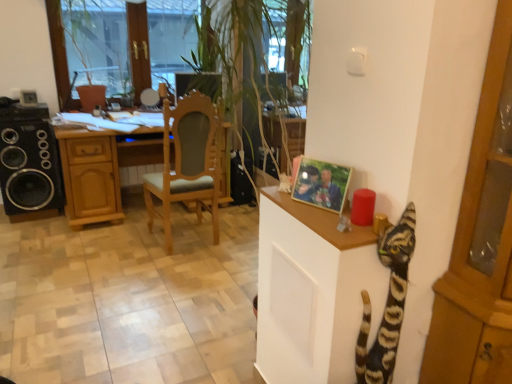
This screenshot has width=512, height=384. In order to click on light brown wood chair at center in this screenshot , I will do `click(188, 163)`.

Image resolution: width=512 pixels, height=384 pixels. What are the coordinates of `wooden photo frame at upper right` in the screenshot? It's located at tap(321, 184).

Find the location of a particular element. This screenshot has width=512, height=384. wooden desk at center is located at coordinates (101, 170).

This screenshot has height=384, width=512. I want to click on black matte speaker at left, so click(29, 161).

You are a GUI agent. You are given a task and a screenshot of the screen. Output one action in this format:
    pyautogui.click(x=<x>, y=<y>)
    Task: Click on the light brown wood chair at center
    Image resolution: width=512 pixels, height=384 pixels.
    Given the screenshot: What is the action you would take?
    [188, 163]

From the image's perspective, would you say light brown wood chair at center is positioned over black matte speaker at left?

Incorrect, from the image's perspective, light brown wood chair at center is lower than black matte speaker at left.

Would you say light brown wood chair at center is a long distance from black matte speaker at left?

Yes.

Is light brown wood chair at center in front of or behind black matte speaker at left in the image?

Clearly, light brown wood chair at center is in front of black matte speaker at left.

Considering the sizes of objects light brown wood chair at center and black matte speaker at left in the image provided, who is thinner, light brown wood chair at center or black matte speaker at left?

black matte speaker at left is thinner.

Does point (33, 112) come behind point (88, 2)?

No.

Is black matte speaker at left smaller than transparent glass window at upper center?

Correct, black matte speaker at left occupies less space than transparent glass window at upper center.

Where is `speaker in front of the transparent glass window at upper center`? speaker in front of the transparent glass window at upper center is located at coordinates (29, 161).

Considering the relative sizes of black matte speaker at left and transparent glass window at upper center in the image provided, is black matte speaker at left wider than transparent glass window at upper center?

Correct, the width of black matte speaker at left exceeds that of transparent glass window at upper center.

From a real-world perspective, is wooden photo frame at upper right positioned over wooden cabinet at right based on gravity?

Indeed, from a real-world perspective, wooden photo frame at upper right stands above wooden cabinet at right.

Is point (325, 191) closer or farther from the camera than point (463, 378)?

Point (325, 191).

What's the angular difference between wooden photo frame at upper right and wooden cabinet at right's facing directions?

The angle between the facing direction of wooden photo frame at upper right and the facing direction of wooden cabinet at right is 70.6 degrees.

Considering the positions of objects wooden photo frame at upper right and wooden cabinet at right in the image provided, who is behind, wooden photo frame at upper right or wooden cabinet at right?

wooden photo frame at upper right is further from the camera.

Would you consider transparent glass window screen at upper left to be distant from black matte speaker at left?

No, transparent glass window screen at upper left is not far away from black matte speaker at left.

Which is less distant, [112,57] or [8,137]?

The point [8,137] is in front.

From the image's perspective, is transparent glass window screen at upper left on black matte speaker at left?

Yes, from the image's perspective, transparent glass window screen at upper left is on top of black matte speaker at left.

Considering the sizes of objects wooden desk at center and wooden photo frame at upper right in the image provided, who is smaller, wooden desk at center or wooden photo frame at upper right?

wooden photo frame at upper right is smaller.

Is wooden desk at center directly adjacent to wooden photo frame at upper right?

No, wooden desk at center is not beside wooden photo frame at upper right.

How much distance is there between wooden desk at center and wooden photo frame at upper right?

wooden desk at center is 2.20 meters from wooden photo frame at upper right.

Would you say wooden desk at center is outside wooden photo frame at upper right?

Indeed, wooden desk at center is completely outside wooden photo frame at upper right.

Does light brown wood chair at center turn towards wooden cabinet at right?

No, light brown wood chair at center is not oriented towards wooden cabinet at right.

Considering the sizes of objects light brown wood chair at center and wooden cabinet at right in the image provided, who is wider, light brown wood chair at center or wooden cabinet at right?

With larger width is light brown wood chair at center.

Considering the positions of objects light brown wood chair at center and wooden cabinet at right in the image provided, who is more to the left, light brown wood chair at center or wooden cabinet at right?

light brown wood chair at center.

Is wooden cabinet at right surrounded by light brown wood chair at center?

No, wooden cabinet at right is located outside of light brown wood chair at center.

Can you tell me how much light brown wood chair at center and wooden desk at center differ in facing direction?

They differ by 180 degrees in their facing directions.

From a real-world perspective, does light brown wood chair at center sit lower than wooden desk at center?

No, from a real-world perspective, light brown wood chair at center is not beneath wooden desk at center.

Who is taller, light brown wood chair at center or wooden desk at center?

Standing taller between the two is light brown wood chair at center.

Is light brown wood chair at center with wooden desk at center?

No, light brown wood chair at center is not beside wooden desk at center.

Find the location of a particular element. chair in front of the black matte speaker at left is located at coordinates coord(188,163).

Where is `window above the black matte speaker at left (from the image's perspective)`? The image size is (512, 384). window above the black matte speaker at left (from the image's perspective) is located at coordinates [x=71, y=54].

Which object lies further to the anchor point black matte speaker at left, wooden desk at center or transparent glass window screen at upper left?

transparent glass window screen at upper left lies further to black matte speaker at left than the other object.

Based on their spatial positions, is wooden cabinet at right or striped fur cat at right further from light brown wood chair at center?

Based on the image, wooden cabinet at right appears to be further to light brown wood chair at center.

When comparing their distances from wooden photo frame at upper right, does transparent glass window at upper center or light brown wood chair at center seem closer?

light brown wood chair at center is positioned closer to the anchor wooden photo frame at upper right.

Based on the photo, from the image, which object appears to be nearer to transparent glass window at upper center, transparent glass window screen at upper left or light brown wood chair at center?

The object closer to transparent glass window at upper center is transparent glass window screen at upper left.

Estimate the real-world distances between objects in this image. Which object is closer to wooden desk at center, wooden cabinet at right or light brown wood chair at center?

The object closer to wooden desk at center is light brown wood chair at center.

Based on their spatial positions, is wooden photo frame at upper right or striped fur cat at right further from transparent glass window at upper center?

striped fur cat at right lies further to transparent glass window at upper center than the other object.

From the image, which object appears to be nearer to wooden cabinet at right, striped fur cat at right or wooden desk at center?

striped fur cat at right lies closer to wooden cabinet at right than the other object.

Which object lies nearer to the anchor point striped fur cat at right, wooden desk at center or light brown wood chair at center?

light brown wood chair at center lies closer to striped fur cat at right than the other object.

You are a GUI agent. You are given a task and a screenshot of the screen. Output one action in this format:
    pyautogui.click(x=<x>, y=<y>)
    Task: Click on the picture frame between striped fur cat at right and transparent glass window screen at upper left from front to back
    The height and width of the screenshot is (384, 512).
    Given the screenshot: What is the action you would take?
    pyautogui.click(x=321, y=184)

Where is `desk between wooden cabinet at right and transparent glass window screen at upper left in the front-back direction`? desk between wooden cabinet at right and transparent glass window screen at upper left in the front-back direction is located at coordinates (101, 170).

The image size is (512, 384). In order to click on picture frame located between striped fur cat at right and wooden desk at center in the depth direction in this screenshot , I will do `click(321, 184)`.

This screenshot has width=512, height=384. Identify the location of window screen located between wooden photo frame at upper right and transparent glass window at upper center in the depth direction. (97, 43).